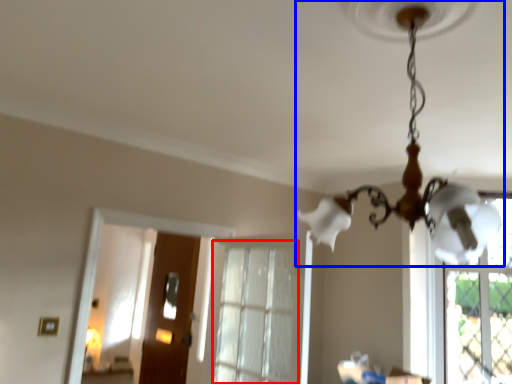
Question: Which object is further to the camera taking this photo, window (highlighted by a red box) or lamp (highlighted by a blue box)?

Choices:
 (A) window
 (B) lamp

Answer: (A)